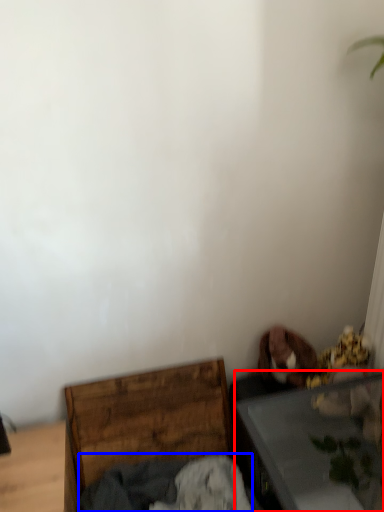
Question: Among these objects, which one is nearest to the camera, table (highlighted by a red box) or clothing (highlighted by a blue box)?

Choices:
 (A) table
 (B) clothing

Answer: (A)